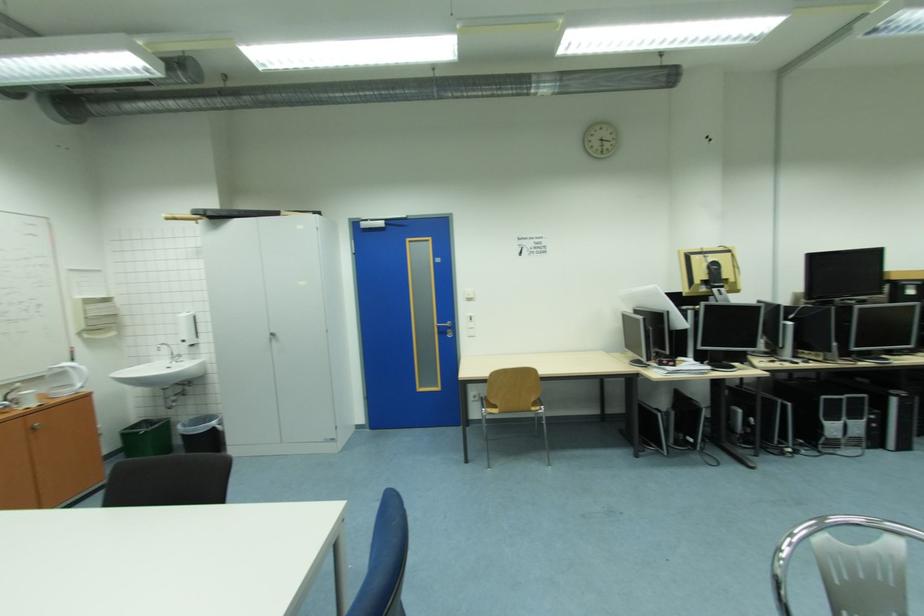
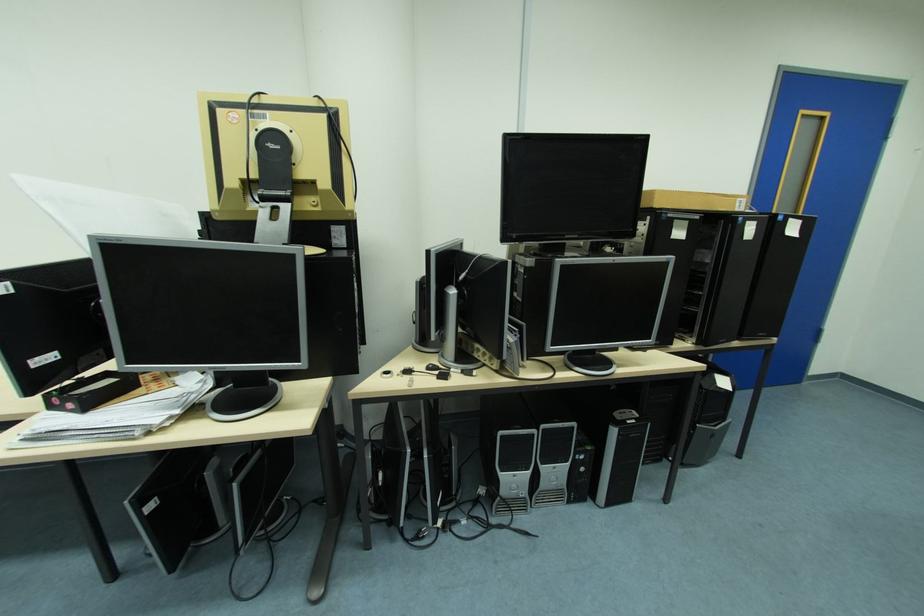
In the second image, find the point that corresponds to [881,426] in the first image.

(590, 469)